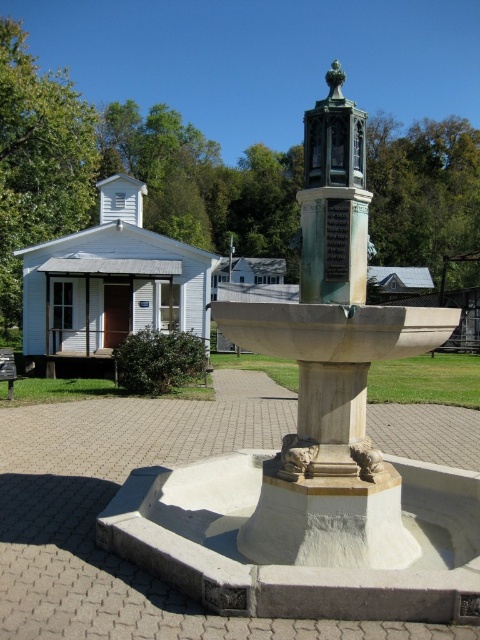
You are standing in the outdoor area and want to walk from the white stone fountain at center to the green patina metal bell tower at center. Which direction should you head?

Since the white stone fountain at center is to the left of the green patina metal bell tower at center, you should head to the right to reach the bell tower.

You are standing at the point labeled as point (316,444) in the image. What object are you directly facing?

You are directly facing the white stone fountain at center as indicated by the point (316,444).